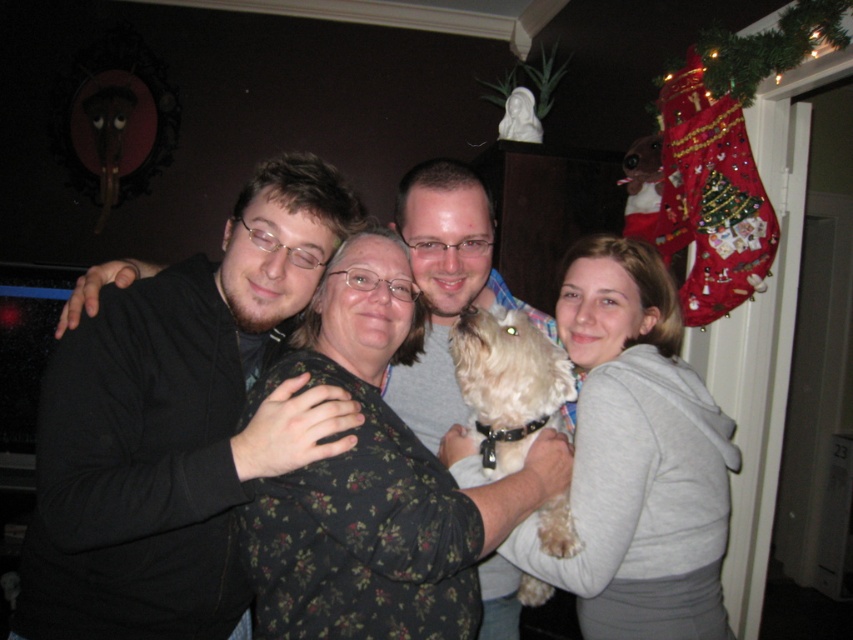
Question: Which of the following is the farthest from the observer?

Choices:
 (A) gray fleece at right
 (B) fluffy white dog at center

Answer: (B)

Question: Which point appears farthest from the camera in this image?

Choices:
 (A) (440, 209)
 (B) (38, 611)
 (C) (396, 536)
 (D) (548, 593)

Answer: (D)

Question: Can you confirm if fluffy white dog at center is thinner than white fluffy dog at center?

Choices:
 (A) yes
 (B) no

Answer: (B)

Question: Which point appears farthest from the camera in this image?

Choices:
 (A) (311, 365)
 (B) (496, 476)
 (C) (416, 248)
 (D) (241, 576)

Answer: (C)

Question: Does gray fleece at right appear over white fluffy dog at center?

Choices:
 (A) no
 (B) yes

Answer: (B)

Question: Is black matte jacket at left above gray cotton shirt at center?

Choices:
 (A) yes
 (B) no

Answer: (B)